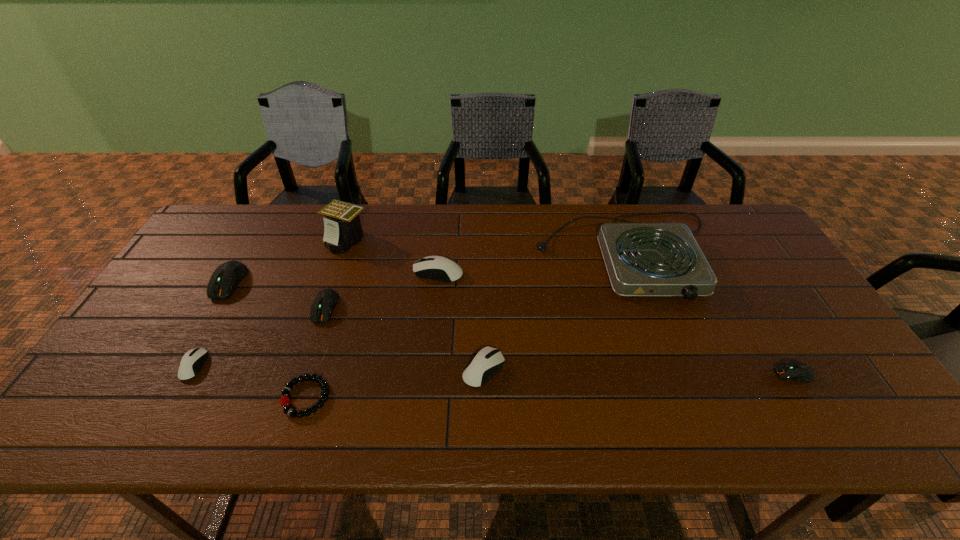
Locate an element on the screen. calculator is located at coordinates (342, 228).

Locate an element on the screen. Image resolution: width=960 pixels, height=540 pixels. the eighth shortest object is located at coordinates (642, 259).

Locate an element on the screen. The height and width of the screenshot is (540, 960). the fourth object from right to left is located at coordinates (439, 268).

The height and width of the screenshot is (540, 960). Find the location of `the third computer equipment from right to left`. the third computer equipment from right to left is located at coordinates (439, 268).

Find the location of a particular element. Image resolution: width=960 pixels, height=540 pixels. the leftmost dark computer equipment is located at coordinates (224, 280).

The image size is (960, 540). What are the coordinates of `the second smallest white mouse` in the screenshot? It's located at (488, 361).

At what (x,y) coordinates should I click in order to perform the action: click on the seventh object from left to right. Please return your answer as a coordinate pair (x, y). Looking at the image, I should click on (488, 361).

Locate an element on the screen. The image size is (960, 540). the second biggest dark computer equipment is located at coordinates (324, 302).

Locate an element on the screen. The height and width of the screenshot is (540, 960). the fourth computer equipment from right to left is located at coordinates (324, 302).

Locate an element on the screen. The image size is (960, 540). the leftmost white mouse is located at coordinates (192, 361).